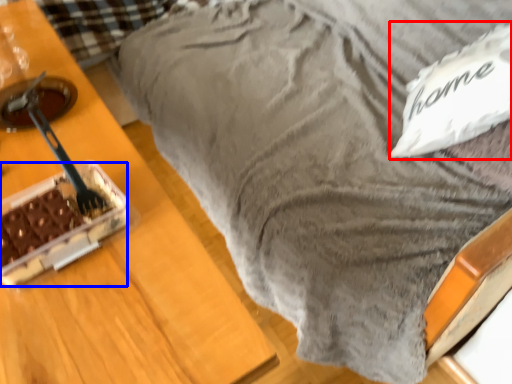
Question: Which object is closer to the camera taking this photo, pillow (highlighted by a red box) or cake (highlighted by a blue box)?

Choices:
 (A) pillow
 (B) cake

Answer: (B)